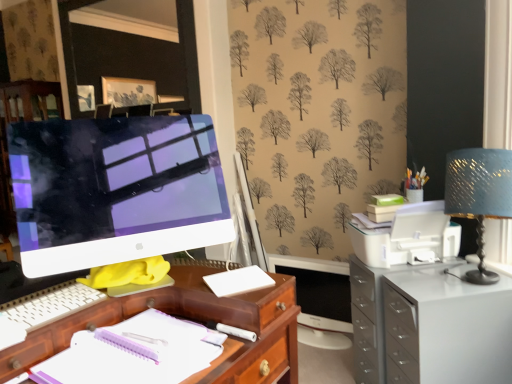
Question: From a real-world perspective, is white glossy computer monitor at left positioned over white paper notebook at center based on gravity?

Choices:
 (A) yes
 (B) no

Answer: (A)

Question: Is white glossy computer monitor at left thinner than white paper notebook at center?

Choices:
 (A) yes
 (B) no

Answer: (A)

Question: Considering the relative sizes of white glossy computer monitor at left and white paper notebook at center in the image provided, is white glossy computer monitor at left bigger than white paper notebook at center?

Choices:
 (A) yes
 (B) no

Answer: (A)

Question: Considering the relative positions of white glossy computer monitor at left and white paper notebook at center in the image provided, is white glossy computer monitor at left behind white paper notebook at center?

Choices:
 (A) no
 (B) yes

Answer: (B)

Question: Is white glossy computer monitor at left facing away from white paper notebook at center?

Choices:
 (A) yes
 (B) no

Answer: (B)

Question: Considering the positions of white matte cutting board at center and blue textured lampshade at upper right in the image, is white matte cutting board at center taller or shorter than blue textured lampshade at upper right?

Choices:
 (A) short
 (B) tall

Answer: (A)

Question: In terms of size, does white matte cutting board at center appear bigger or smaller than blue textured lampshade at upper right?

Choices:
 (A) big
 (B) small

Answer: (B)

Question: Is white matte cutting board at center spatially inside blue textured lampshade at upper right, or outside of it?

Choices:
 (A) inside
 (B) outside

Answer: (B)

Question: Visually, is white matte cutting board at center positioned to the left or to the right of blue textured lampshade at upper right?

Choices:
 (A) right
 (B) left

Answer: (B)

Question: In terms of height, does white glossy filing cabinet at right look taller or shorter compared to white glossy computer monitor at left?

Choices:
 (A) tall
 (B) short

Answer: (B)

Question: Is white glossy filing cabinet at right in front of or behind white glossy computer monitor at left in the image?

Choices:
 (A) front
 (B) behind

Answer: (A)

Question: Considering the positions of white glossy filing cabinet at right and white glossy computer monitor at left in the image, is white glossy filing cabinet at right wider or thinner than white glossy computer monitor at left?

Choices:
 (A) wide
 (B) thin

Answer: (A)

Question: From a real-world perspective, relative to white glossy computer monitor at left, is white glossy filing cabinet at right vertically above or below?

Choices:
 (A) below
 (B) above

Answer: (A)

Question: From the image's perspective, is blue textured lampshade at upper right above or below white glossy computer monitor at left?

Choices:
 (A) above
 (B) below

Answer: (B)

Question: Do you think blue textured lampshade at upper right is within white glossy computer monitor at left, or outside of it?

Choices:
 (A) inside
 (B) outside

Answer: (B)